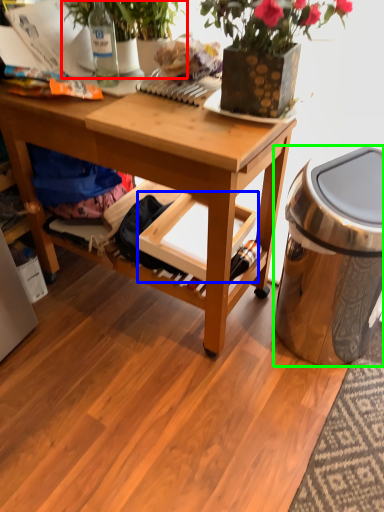
Question: Which is farther away from houseplant (highlighted by a red box)? shelf (highlighted by a blue box) or trash bin/can (highlighted by a green box)?

Choices:
 (A) shelf
 (B) trash bin/can

Answer: (B)